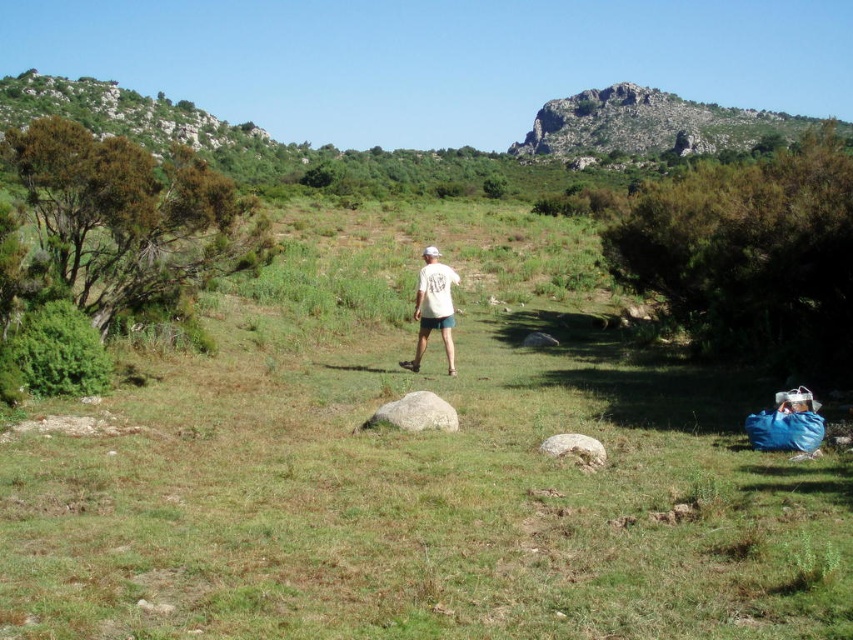
Is green grassy field at center thinner than rugged stone hillside at upper right?

Indeed, green grassy field at center has a lesser width compared to rugged stone hillside at upper right.

Who is shorter, green grassy field at center or rugged stone hillside at upper right?

With less height is green grassy field at center.

The width and height of the screenshot is (853, 640). I want to click on green grassy field at center, so click(415, 470).

Does point (541, 124) come in front of point (427, 326)?

No, (541, 124) is behind (427, 326).

Can you confirm if rugged stone hillside at upper right is positioned above white cotton shirt at center?

Indeed, rugged stone hillside at upper right is positioned over white cotton shirt at center.

Between point (712, 138) and point (432, 307), which one is positioned behind?

The point (712, 138) is behind.

Locate an element on the screen. The height and width of the screenshot is (640, 853). rugged stone hillside at upper right is located at coordinates (648, 125).

Is green grassy field at center thinner than gray smooth rock at center?

Incorrect, green grassy field at center's width is not less than gray smooth rock at center's.

Who is more distant from viewer, (415,604) or (451,426)?

The point (451,426) is more distant.

Image resolution: width=853 pixels, height=640 pixels. Identify the location of green grassy field at center. (415, 470).